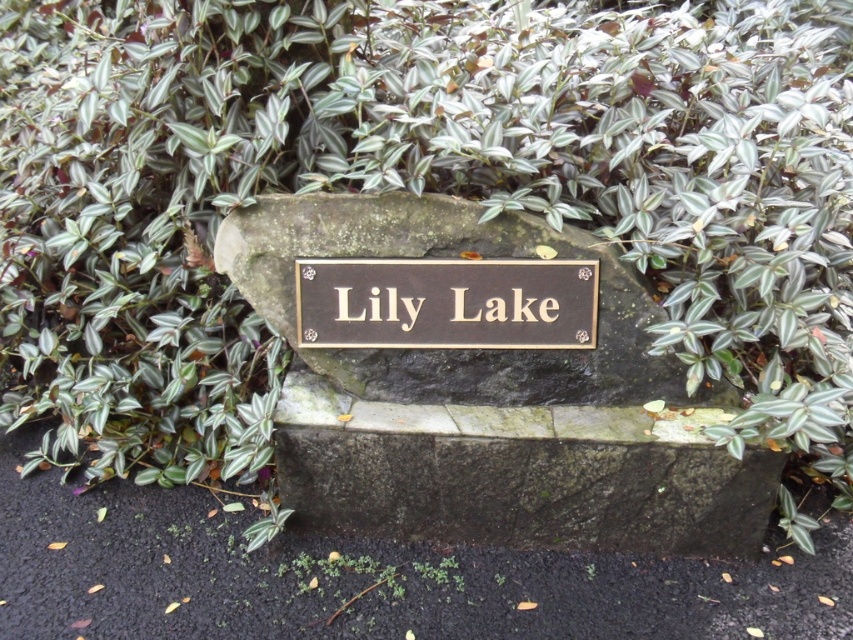
You are a visitor at Lily Lake and want to read the gold plated sign at center and the gold metallic plaque at center. Which one is located lower?

The gold plated sign at center is positioned under the gold metallic plaque at center, so the gold plated sign at center is lower than the gold metallic plaque at center.